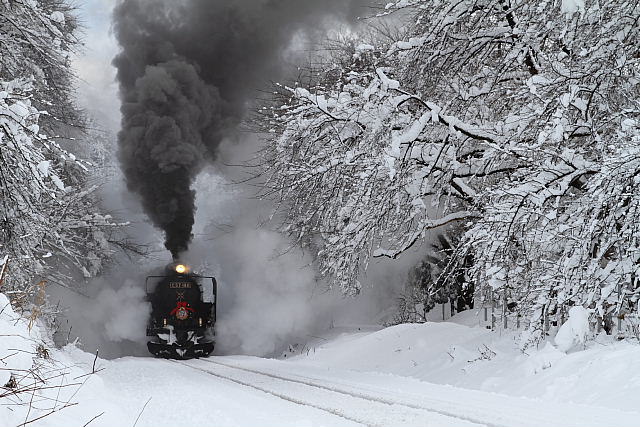
This screenshot has width=640, height=427. Find the location of `light`. light is located at coordinates (200, 320).